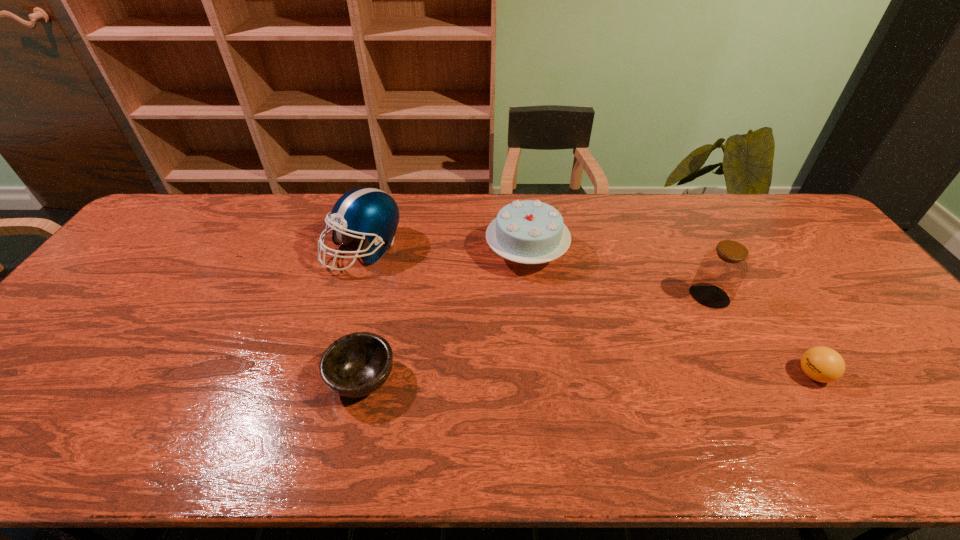
Identify which object is the third nearest to the birthday cake. Please provide its 2D coordinates. Your answer should be formatted as a tuple, i.e. [(x, y)], where the tuple contains the x and y coordinates of a point satisfying the conditions above.

[(357, 364)]

Locate an element on the screen. object that is the fourth closest to the fourth object from left to right is located at coordinates (370, 213).

The width and height of the screenshot is (960, 540). Find the location of `vacant area that satisfies the following two spatial constraints: 1. at the front of the football helmet with the faceguard; 2. on the right side of the fourth object from left to right`. vacant area that satisfies the following two spatial constraints: 1. at the front of the football helmet with the faceguard; 2. on the right side of the fourth object from left to right is located at coordinates (350, 296).

Locate an element on the screen. The image size is (960, 540). vacant area that satisfies the following two spatial constraints: 1. at the front of the football helmet with the faceguard; 2. on the right side of the third object from left to right is located at coordinates (363, 252).

The width and height of the screenshot is (960, 540). In order to click on vacant position in the image that satisfies the following two spatial constraints: 1. at the front of the football helmet with the faceguard; 2. on the right side of the birthday cake in this screenshot , I will do `click(363, 252)`.

Find the location of a particular element. The image size is (960, 540). vacant space that satisfies the following two spatial constraints: 1. at the front of the football helmet with the faceguard; 2. on the right side of the bowl is located at coordinates (326, 379).

Locate an element on the screen. vacant space that satisfies the following two spatial constraints: 1. at the front of the second object from right to left with the faceguard; 2. on the right side of the football helmet is located at coordinates (350, 296).

Image resolution: width=960 pixels, height=540 pixels. Find the location of `free region that satisfies the following two spatial constraints: 1. at the front of the football helmet with the faceguard; 2. on the left side of the third nearest object`. free region that satisfies the following two spatial constraints: 1. at the front of the football helmet with the faceguard; 2. on the left side of the third nearest object is located at coordinates (350, 296).